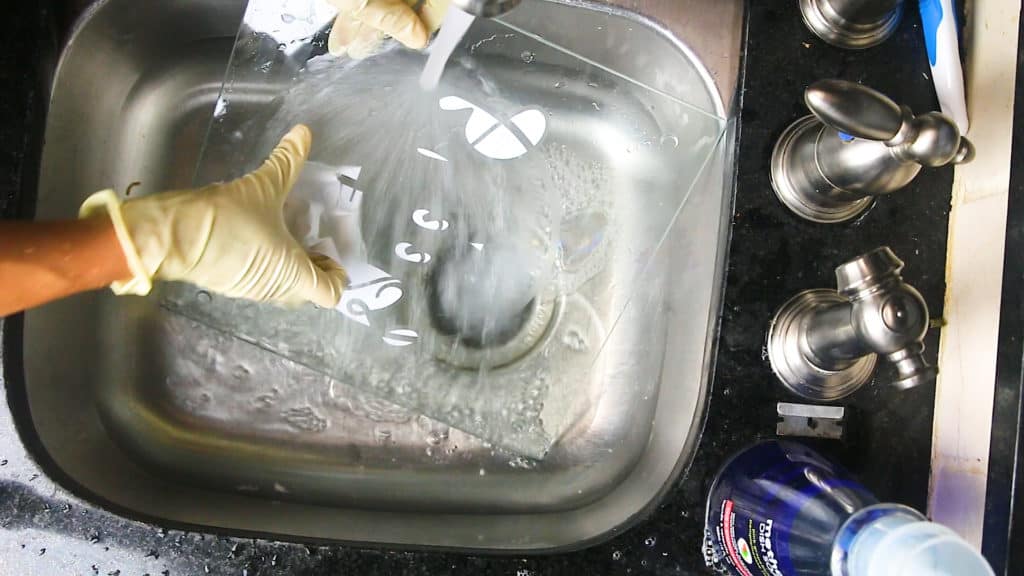
Image resolution: width=1024 pixels, height=576 pixels. I want to click on faucet head, so click(482, 6).